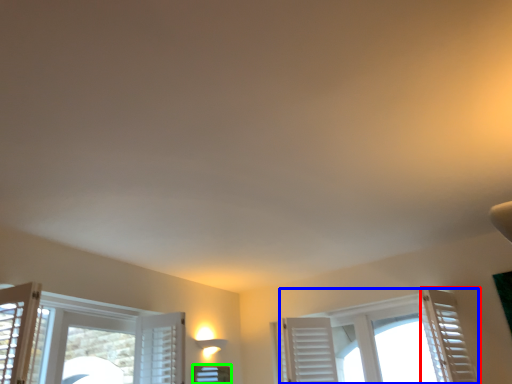
Question: Which object is positioned closest to curtain (highlighted by a red box)? Select from window (highlighted by a blue box) and window (highlighted by a green box).

Choices:
 (A) window
 (B) window

Answer: (A)